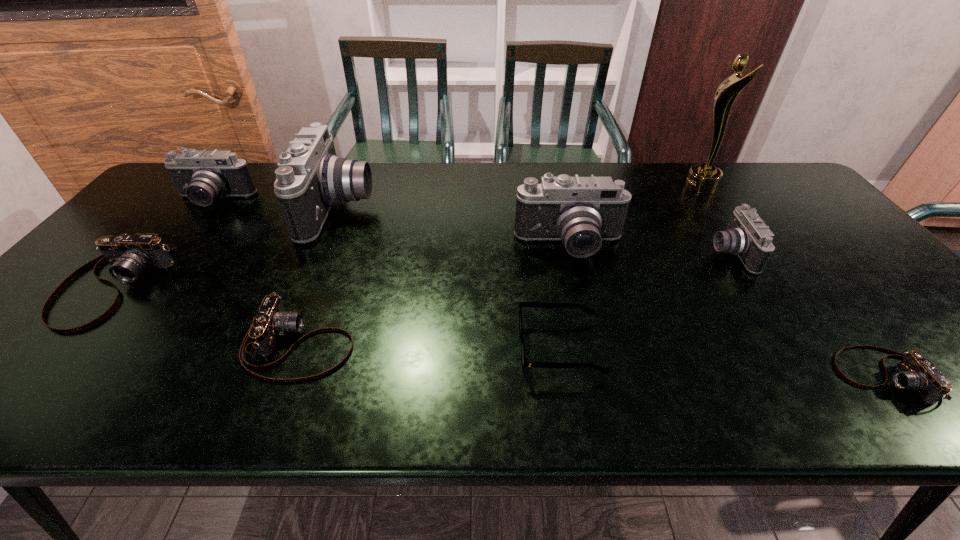
The width and height of the screenshot is (960, 540). What are the coordinates of `vacant space at the left edge of the desktop` in the screenshot? It's located at (84, 305).

Where is `free space at the right edge of the desktop`? free space at the right edge of the desktop is located at coordinates (811, 210).

This screenshot has width=960, height=540. What are the coordinates of `empty space between the tallest object and the rightmost camera` in the screenshot? It's located at (793, 281).

The image size is (960, 540). In order to click on empty space between the rightmost camera and the second tallest object in this screenshot , I will do `click(612, 293)`.

I want to click on unoccupied position between the biggest black camera and the black spectacles, so click(450, 279).

Image resolution: width=960 pixels, height=540 pixels. I want to click on blank region between the fifth shortest object and the biggest brown camera, so click(421, 269).

You are a GUI agent. You are given a task and a screenshot of the screen. Output one action in this format:
    pyautogui.click(x=<x>, y=<y>)
    Task: Click on the vacant region between the rightmost black camera and the rightmost brown camera
    The image size is (960, 540).
    Given the screenshot: What is the action you would take?
    pyautogui.click(x=807, y=314)

In order to click on empty location between the second smallest brown camera and the third biggest black camera in this screenshot , I will do `click(256, 273)`.

Find the location of `free space between the rightmost camera and the smallest black camera`. free space between the rightmost camera and the smallest black camera is located at coordinates (807, 314).

Locate an element on the screen. The width and height of the screenshot is (960, 540). free space between the third smallest black camera and the third black camera from right to left is located at coordinates click(455, 228).